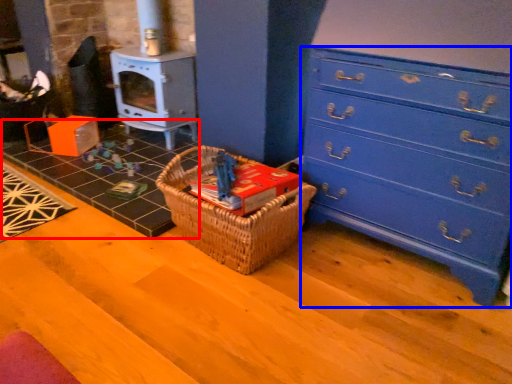
Question: Which object appears closest to the camera in this image, tile (highlighted by a red box) or chest of drawers (highlighted by a blue box)?

Choices:
 (A) tile
 (B) chest of drawers

Answer: (B)